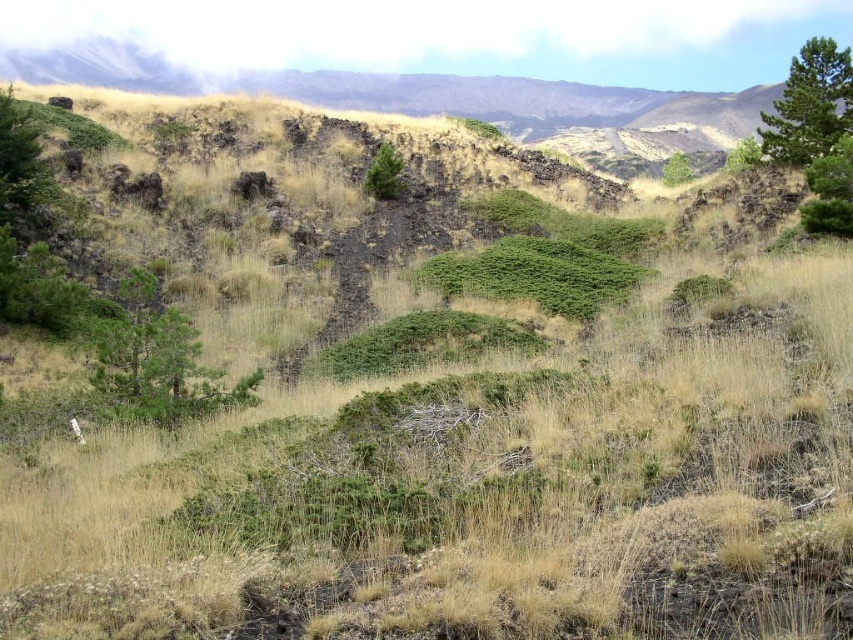
Question: Which is nearer to the green textured tree at upper right?

Choices:
 (A) green leafy tree at upper center
 (B) green textured tree at center
 (C) green leafy tree at right

Answer: (C)

Question: Can you confirm if green textured tree at center is wider than green leafy tree at upper center?

Choices:
 (A) yes
 (B) no

Answer: (B)

Question: Does green textured tree at center have a greater width compared to green leafy tree at upper right?

Choices:
 (A) no
 (B) yes

Answer: (A)

Question: Which of the following is the closest to the observer?

Choices:
 (A) (827, 180)
 (B) (728, 161)

Answer: (A)

Question: Which of the following is the farthest from the observer?

Choices:
 (A) (688, 163)
 (B) (744, 140)
 (C) (809, 77)

Answer: (B)

Question: Considering the relative positions of green textured tree at upper right and green textured tree at center in the image provided, where is green textured tree at upper right located with respect to green textured tree at center?

Choices:
 (A) above
 (B) below

Answer: (A)